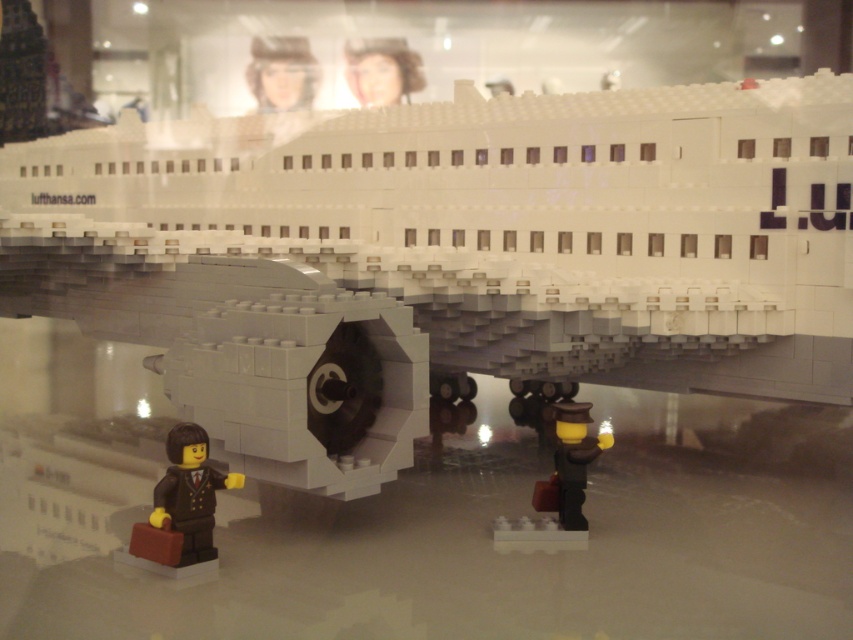
Consider the image. You are a LEGO designer trying to place a new accessory on the model airplane. You have a small LEGO brick that needs to be positioned between the brown matte briefcase at lower left and the matte plastic head at upper center. Based on their positions, where should you place the brick?

The brown matte briefcase at lower left is to the right of the matte plastic head at upper center, so the brick should be placed between them, closer to the matte plastic head at upper center since the briefcase is positioned to its right.

You are a LEGO enthusiast who wants to place a small LEGO brick on the ground between the brown matte briefcase at lower left and the matte white airplane at center. Based on their positions, which object is closer to the left edge of the scene?

The brown matte briefcase at lower left is closer to the left edge of the scene because it is positioned to the left of the matte white airplane at center.